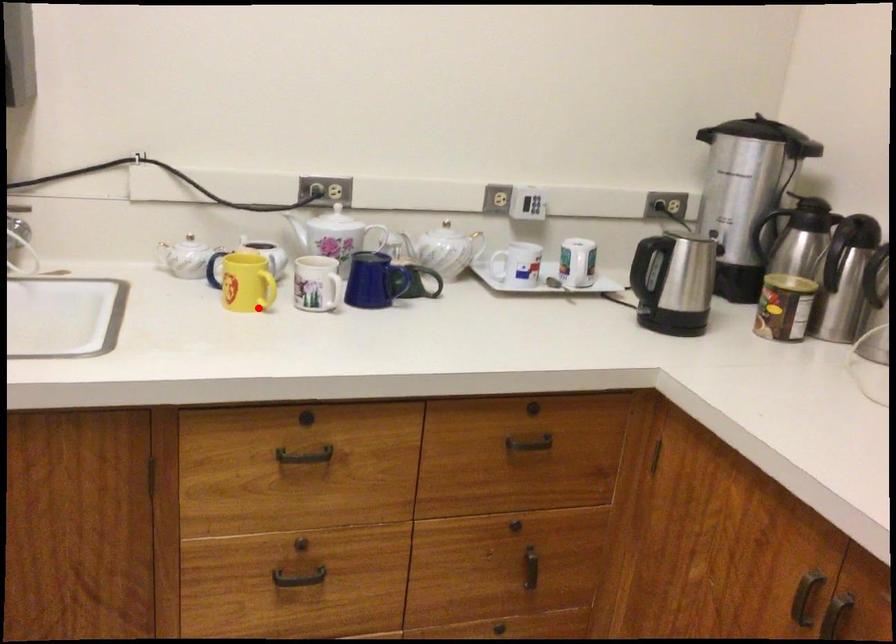
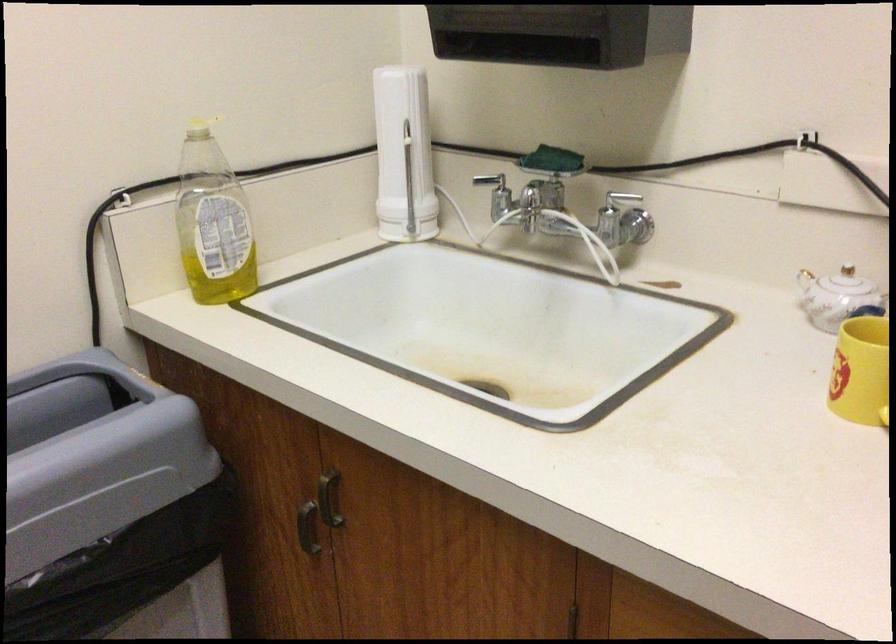
In the second image, find the point that corresponds to the highlighted location in the first image.

(877, 417)